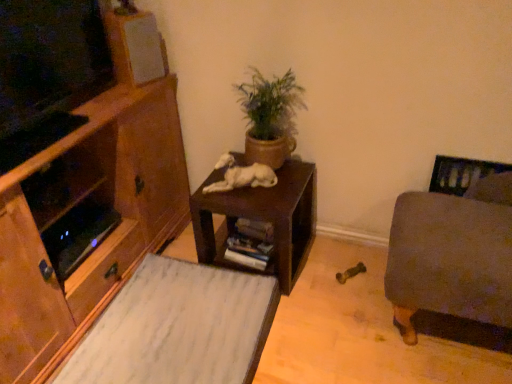
Question: Does velvet gray ottoman at right lie in front of green matte plant pot at center?

Choices:
 (A) no
 (B) yes

Answer: (B)

Question: Is velvet gray ottoman at right at the left side of green matte plant pot at center?

Choices:
 (A) yes
 (B) no

Answer: (B)

Question: From the image's perspective, is velvet gray ottoman at right on green matte plant pot at center?

Choices:
 (A) yes
 (B) no

Answer: (B)

Question: Is velvet gray ottoman at right directly adjacent to green matte plant pot at center?

Choices:
 (A) yes
 (B) no

Answer: (B)

Question: Can you confirm if velvet gray ottoman at right is wider than green matte plant pot at center?

Choices:
 (A) no
 (B) yes

Answer: (B)

Question: Looking at their shapes, would you say green matte plant pot at center is wider or thinner than wooden cabinet at left?

Choices:
 (A) wide
 (B) thin

Answer: (B)

Question: Is point (248, 160) closer or farther from the camera than point (71, 271)?

Choices:
 (A) farther
 (B) closer

Answer: (A)

Question: Considering the relative positions of green matte plant pot at center and wooden cabinet at left in the image provided, is green matte plant pot at center to the left or to the right of wooden cabinet at left?

Choices:
 (A) right
 (B) left

Answer: (A)

Question: In terms of height, does green matte plant pot at center look taller or shorter compared to wooden cabinet at left?

Choices:
 (A) short
 (B) tall

Answer: (A)

Question: In terms of height, does velvet gray ottoman at right look taller or shorter compared to green matte plant pot at center?

Choices:
 (A) short
 (B) tall

Answer: (B)

Question: Considering the positions of velvet gray ottoman at right and green matte plant pot at center in the image, is velvet gray ottoman at right bigger or smaller than green matte plant pot at center?

Choices:
 (A) big
 (B) small

Answer: (A)

Question: Considering the positions of velvet gray ottoman at right and green matte plant pot at center in the image, is velvet gray ottoman at right wider or thinner than green matte plant pot at center?

Choices:
 (A) thin
 (B) wide

Answer: (B)

Question: Is velvet gray ottoman at right in front of or behind green matte plant pot at center in the image?

Choices:
 (A) behind
 (B) front

Answer: (B)

Question: Considering the positions of white matte speaker at upper left and velvet gray ottoman at right in the image, is white matte speaker at upper left wider or thinner than velvet gray ottoman at right?

Choices:
 (A) thin
 (B) wide

Answer: (A)

Question: Is point (108, 28) positioned closer to the camera than point (507, 273)?

Choices:
 (A) closer
 (B) farther

Answer: (B)